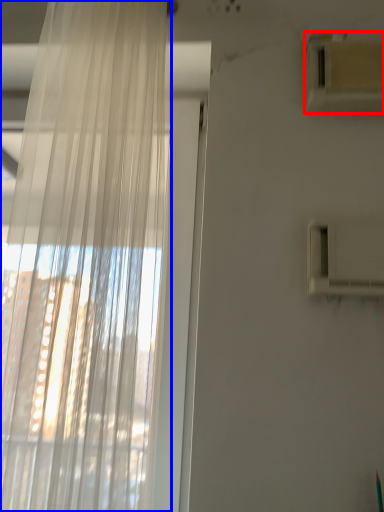
Question: Among these objects, which one is farthest to the camera, air conditioning (highlighted by a red box) or curtain (highlighted by a blue box)?

Choices:
 (A) air conditioning
 (B) curtain

Answer: (A)